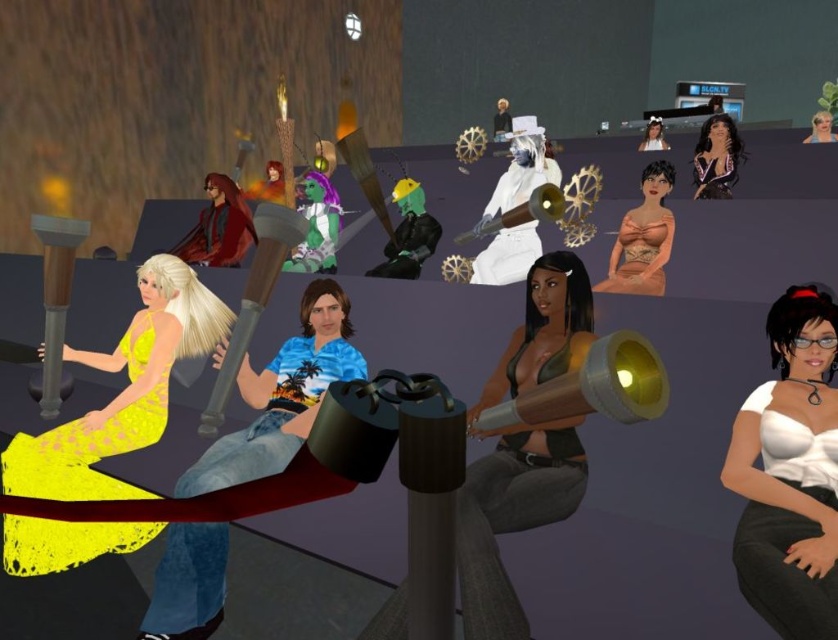
You are an avatar in the scene and want to reach the white matte blouse at center. Based on the coordinates provided, which direction should you move from your current position at point 0.5, 0.5?

The white matte blouse at center is located at coordinates (790, 472). Since your current position is at (419, 320), you should move northeast to reach it.

You are an avatar in the scene and want to know which object is taller between the shiny purple dress at upper right and the smooth white hair at upper right. Based on their positions, which one is taller?

The shiny purple dress at upper right is much taller than the smooth white hair at upper right according to their positions in the scene.

You are attending a virtual meeting and need to present your outfit choices. Which of the two outfits, the white matte blouse at center or the yellow lace dress at lower left, is narrower in width?

The white matte blouse at center is thinner than the yellow lace dress at lower left, so the white matte blouse at center is narrower in width.